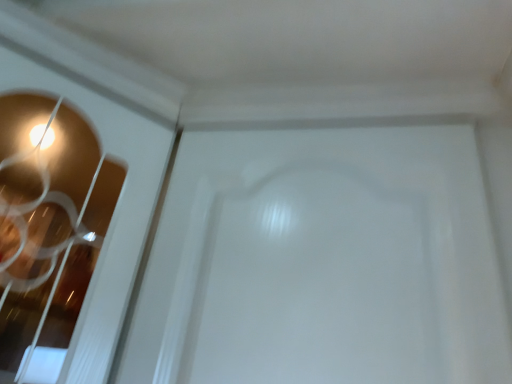
What do you see at coordinates (322, 262) in the screenshot? I see `white glossy door at center` at bounding box center [322, 262].

Where is `white glossy door at center`? white glossy door at center is located at coordinates (322, 262).

Image resolution: width=512 pixels, height=384 pixels. I want to click on white glossy door at center, so click(322, 262).